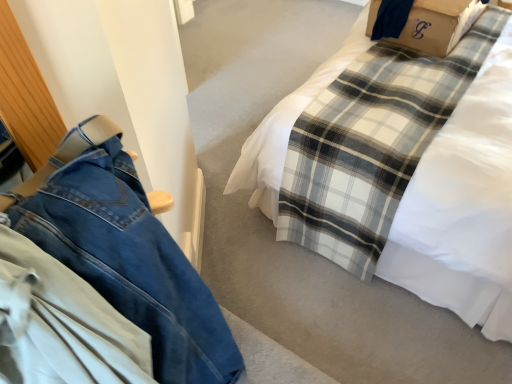
Question: Is white plaid blanket at center bigger than brown cardboard box at upper right?

Choices:
 (A) no
 (B) yes

Answer: (B)

Question: Is white plaid blanket at center turned away from brown cardboard box at upper right?

Choices:
 (A) no
 (B) yes

Answer: (B)

Question: Considering the relative sizes of white plaid blanket at center and brown cardboard box at upper right in the image provided, is white plaid blanket at center wider than brown cardboard box at upper right?

Choices:
 (A) yes
 (B) no

Answer: (A)

Question: From the image's perspective, does white plaid blanket at center appear higher than brown cardboard box at upper right?

Choices:
 (A) no
 (B) yes

Answer: (A)

Question: Is brown cardboard box at upper right surrounded by white plaid blanket at center?

Choices:
 (A) no
 (B) yes

Answer: (B)

Question: From the image's perspective, relative to brown cardboard box at upper right, is denim pants at left above or below?

Choices:
 (A) below
 (B) above

Answer: (A)

Question: Which is correct: denim pants at left is inside brown cardboard box at upper right, or outside of it?

Choices:
 (A) outside
 (B) inside

Answer: (A)

Question: Considering the relative positions of denim pants at left and brown cardboard box at upper right in the image provided, is denim pants at left to the left or to the right of brown cardboard box at upper right?

Choices:
 (A) right
 (B) left

Answer: (B)

Question: Relative to brown cardboard box at upper right, is denim pants at left in front or behind?

Choices:
 (A) behind
 (B) front

Answer: (B)

Question: Does point (109, 291) appear closer or farther from the camera than point (268, 188)?

Choices:
 (A) closer
 (B) farther

Answer: (A)

Question: From the image's perspective, is denim pants at left above or below white plaid blanket at center?

Choices:
 (A) below
 (B) above

Answer: (A)

Question: Looking at their shapes, would you say denim pants at left is wider or thinner than white plaid blanket at center?

Choices:
 (A) thin
 (B) wide

Answer: (A)

Question: In terms of height, does denim pants at left look taller or shorter compared to white plaid blanket at center?

Choices:
 (A) short
 (B) tall

Answer: (A)

Question: Is white plaid blanket at center bigger or smaller than denim pants at left?

Choices:
 (A) big
 (B) small

Answer: (A)

Question: From their relative heights in the image, would you say white plaid blanket at center is taller or shorter than denim pants at left?

Choices:
 (A) tall
 (B) short

Answer: (A)